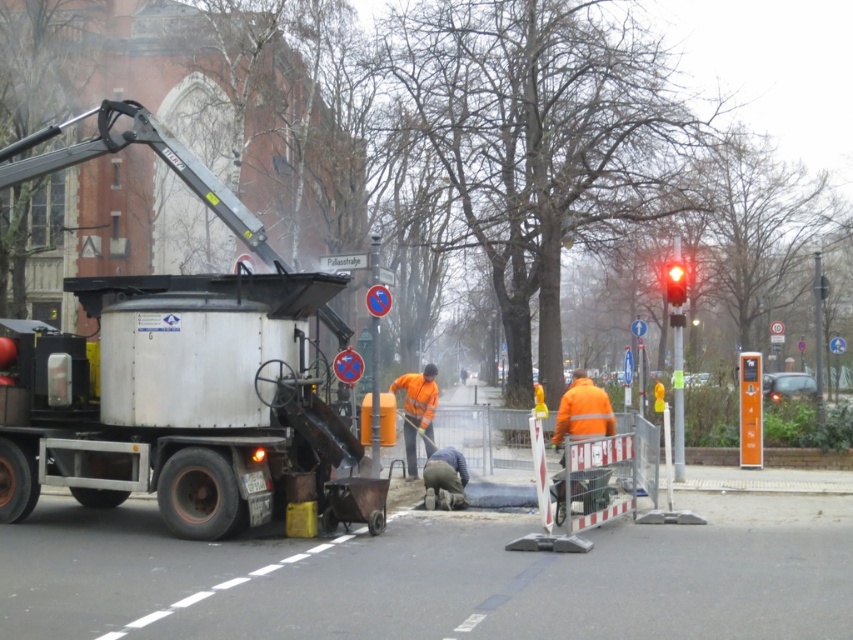
Does silver metallic truck at left appear on the left side of red glass traffic light at upper right?

Yes, silver metallic truck at left is to the left of red glass traffic light at upper right.

From the picture: Is silver metallic truck at left positioned at the back of red glass traffic light at upper right?

No, silver metallic truck at left is closer to the viewer.

You are a GUI agent. You are given a task and a screenshot of the screen. Output one action in this format:
    pyautogui.click(x=<x>, y=<y>)
    Task: Click on the silver metallic truck at left
    
    Given the screenshot: What is the action you would take?
    pyautogui.click(x=172, y=371)